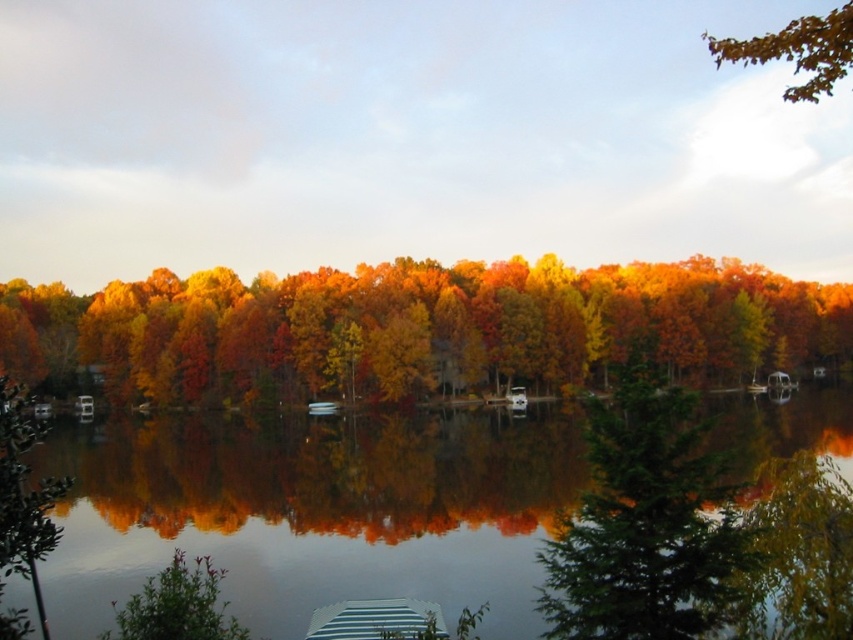
Question: Which point is farther from the camera taking this photo?

Choices:
 (A) (15, 305)
 (B) (808, 388)
 (C) (1, 397)

Answer: (A)

Question: Does transparent water at center have a larger size compared to orange matte tree at center?

Choices:
 (A) no
 (B) yes

Answer: (A)

Question: Does orange matte tree at center have a larger size compared to brown matte leaves at upper right?

Choices:
 (A) yes
 (B) no

Answer: (B)

Question: Is orange matte tree at center in front of green matte evergreen tree at center?

Choices:
 (A) yes
 (B) no

Answer: (B)

Question: Which of the following is the closest to the observer?

Choices:
 (A) (259, 621)
 (B) (26, 416)
 (C) (733, 600)

Answer: (C)

Question: Which point is farther from the camera taking this photo?

Choices:
 (A) (10, 499)
 (B) (851, 65)
 (C) (660, 474)
 (D) (506, 308)

Answer: (D)